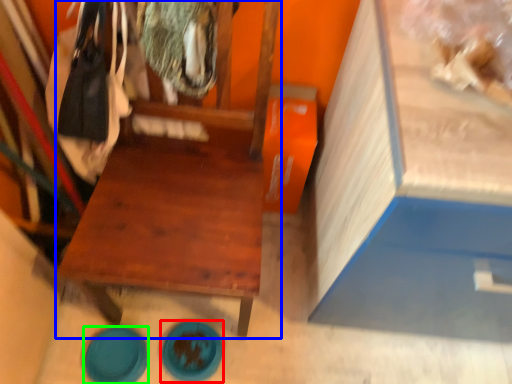
Question: Which object is positioned farthest from plate (highlighted by a red box)? Select from furniture (highlighted by a blue box) and plate (highlighted by a green box).

Choices:
 (A) furniture
 (B) plate

Answer: (A)